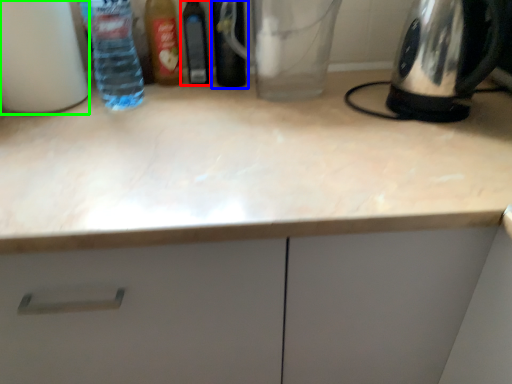
Question: Which object is positioned closest to bottle (highlighted by a red box)? Select from bottle (highlighted by a blue box) and bottle (highlighted by a green box).

Choices:
 (A) bottle
 (B) bottle

Answer: (A)